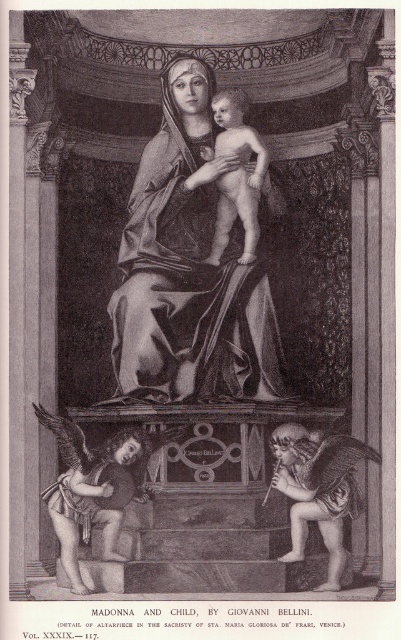
You are an art conservator examining the altarpiece. You notice two points of concern marked on the artwork at coordinates point (127, 252) and point (234, 198). Which point is closer to the viewer?

Point (127, 252) is closer to the viewer than point (234, 198).

Consider the image. In the altarpiece detail by Giovanni Bellini, you observe the smooth gray fabric at center and the smooth flesh baby at center. Which object is located more to the left?

The smooth gray fabric at center is positioned on the left side of the smooth flesh baby at center, so it is more to the left.